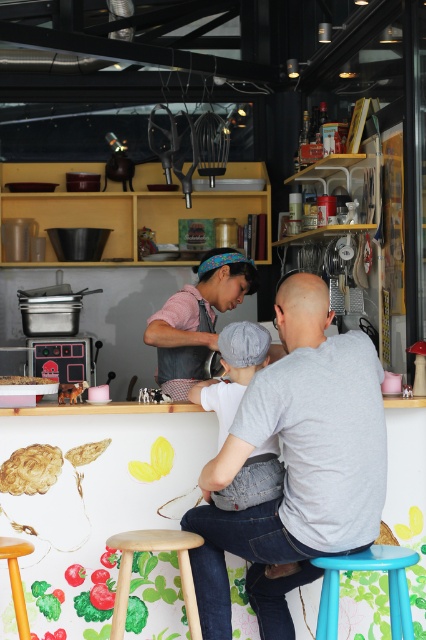
Question: Can you confirm if gray cotton shirt at center is positioned to the right of blue plastic stool at lower right?

Choices:
 (A) yes
 (B) no

Answer: (B)

Question: Is gray cotton shirt at center to the right of natural wood stool at lower center from the viewer's perspective?

Choices:
 (A) no
 (B) yes

Answer: (B)

Question: Which of these objects is positioned closest to the denim baby carrier at center?

Choices:
 (A) white glossy cake at center
 (B) blue plastic stool at lower right
 (C) smooth brown bread at center

Answer: (B)

Question: Does pink fabric apron at center appear under white glossy cake at center?

Choices:
 (A) yes
 (B) no

Answer: (B)

Question: Which of the following is the closest to the observer?

Choices:
 (A) (213, 332)
 (B) (123, 577)
 (C) (22, 625)

Answer: (C)

Question: Which of the following is the closest to the observer?

Choices:
 (A) (195, 332)
 (B) (181, 566)

Answer: (B)